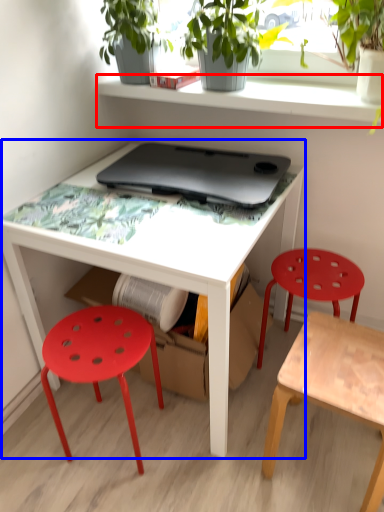
Question: Which object is closer to the camera taking this photo, shelf (highlighted by a red box) or table (highlighted by a blue box)?

Choices:
 (A) shelf
 (B) table

Answer: (B)